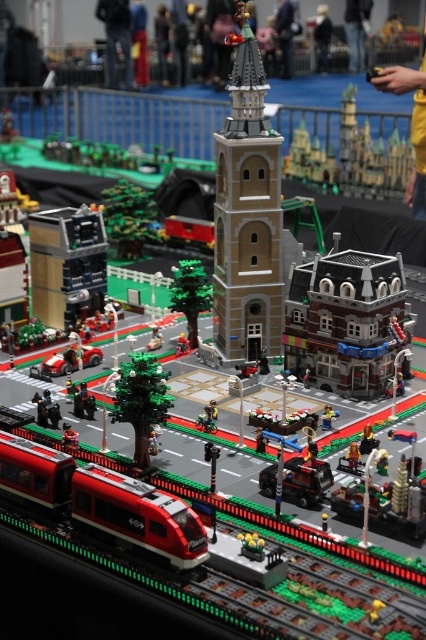
Is light brown brick tower at center shorter than shiny red train at lower left?

In fact, light brown brick tower at center may be taller than shiny red train at lower left.

Locate an element on the screen. Image resolution: width=426 pixels, height=640 pixels. light brown brick tower at center is located at coordinates (247, 214).

Does smooth plastic train track at center appear on the left side of light brown brick tower at center?

Yes, smooth plastic train track at center is to the left of light brown brick tower at center.

Is point (69, 554) positioned before point (239, 189)?

Yes, point (69, 554) is in front of point (239, 189).

Locate an element on the screen. smooth plastic train track at center is located at coordinates (247, 586).

Does smooth plastic train track at center appear on the left side of shiny red train at lower left?

Incorrect, smooth plastic train track at center is not on the left side of shiny red train at lower left.

Find the location of a particular element. The width and height of the screenshot is (426, 640). smooth plastic train track at center is located at coordinates coord(247,586).

Which is in front, point (267, 630) or point (173, 509)?

Point (267, 630) is in front.

Find the location of `smooth plastic train track at center`. smooth plastic train track at center is located at coordinates [x=247, y=586].